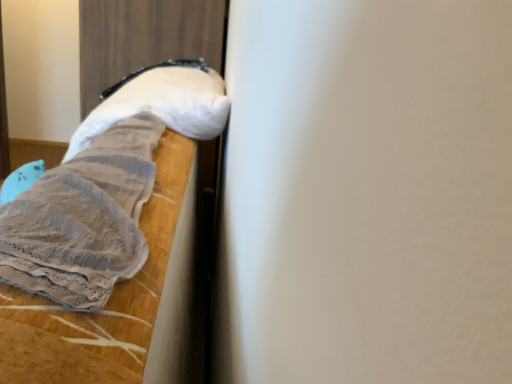
Question: Visually, is white fluffy pillow at upper left positioned to the left or to the right of gray textured fabric at left?

Choices:
 (A) left
 (B) right

Answer: (A)

Question: Looking at the image, does white fluffy pillow at upper left seem bigger or smaller compared to gray textured fabric at left?

Choices:
 (A) small
 (B) big

Answer: (B)

Question: From a real-world perspective, is white fluffy pillow at upper left physically located above or below gray textured fabric at left?

Choices:
 (A) above
 (B) below

Answer: (A)

Question: From a real-world perspective, relative to white fluffy pillow at upper left, is gray textured fabric at left vertically above or below?

Choices:
 (A) below
 (B) above

Answer: (A)

Question: Is gray textured fabric at left situated inside white fluffy pillow at upper left or outside?

Choices:
 (A) inside
 (B) outside

Answer: (B)

Question: Does point (38, 273) appear closer or farther from the camera than point (82, 130)?

Choices:
 (A) farther
 (B) closer

Answer: (B)

Question: In terms of width, does gray textured fabric at left look wider or thinner when compared to white fluffy pillow at upper left?

Choices:
 (A) wide
 (B) thin

Answer: (B)